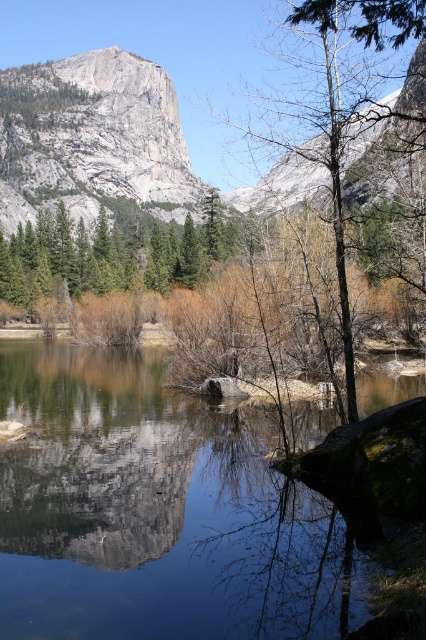
Is transparent water at center to the right of gray rock mountain at upper left from the viewer's perspective?

Yes, transparent water at center is to the right of gray rock mountain at upper left.

Describe the element at coordinates (157, 509) in the screenshot. This screenshot has height=640, width=426. I see `transparent water at center` at that location.

Describe the element at coordinates (157, 509) in the screenshot. I see `transparent water at center` at that location.

This screenshot has height=640, width=426. I want to click on transparent water at center, so click(157, 509).

Which of these two, gray rock mountain at upper left or green matte tree at center, stands taller?

gray rock mountain at upper left is taller.

Can you confirm if gray rock mountain at upper left is wider than green matte tree at center?

Correct, the width of gray rock mountain at upper left exceeds that of green matte tree at center.

Who is more forward, (x=120, y=179) or (x=135, y=275)?

Positioned in front is point (x=135, y=275).

Locate an element on the screen. The width and height of the screenshot is (426, 640). gray rock mountain at upper left is located at coordinates (92, 138).

Can you confirm if transparent water at center is smaller than bare branches at center?

Yes.

In the scene shown: Does transparent water at center appear over bare branches at center?

Incorrect, transparent water at center is not positioned above bare branches at center.

This screenshot has width=426, height=640. Find the location of `transparent water at center`. transparent water at center is located at coordinates (157, 509).